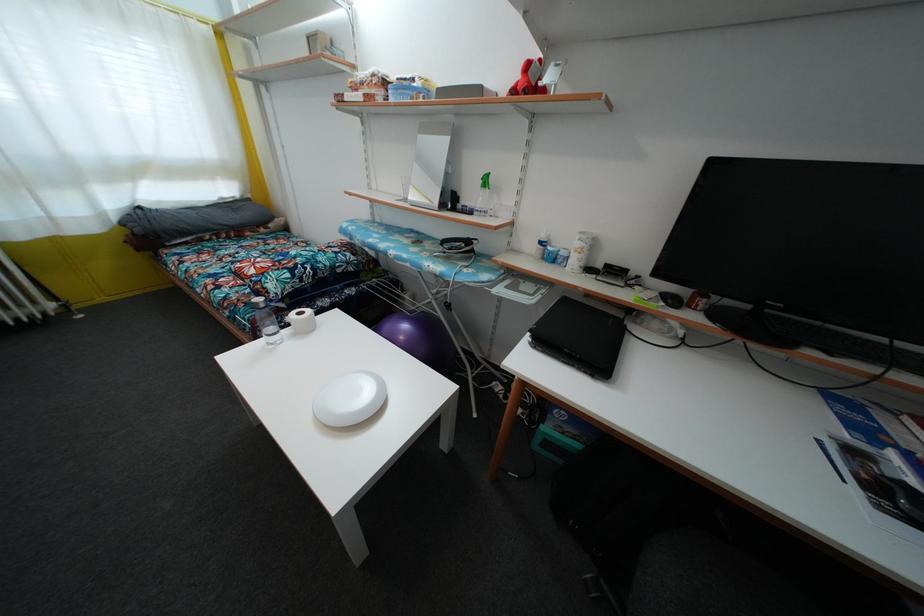
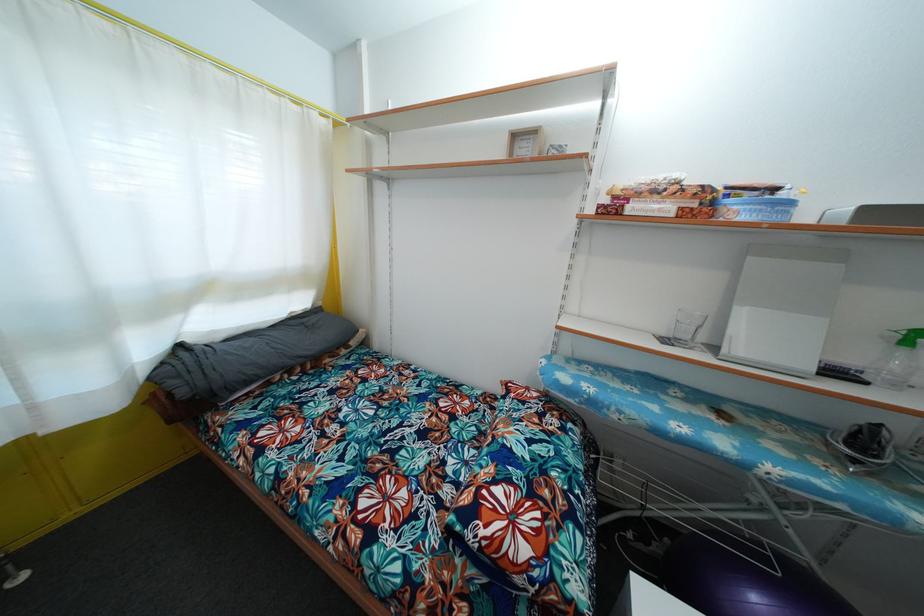
Find the pixel in the second image that matches [141,237] in the first image.

(187, 399)